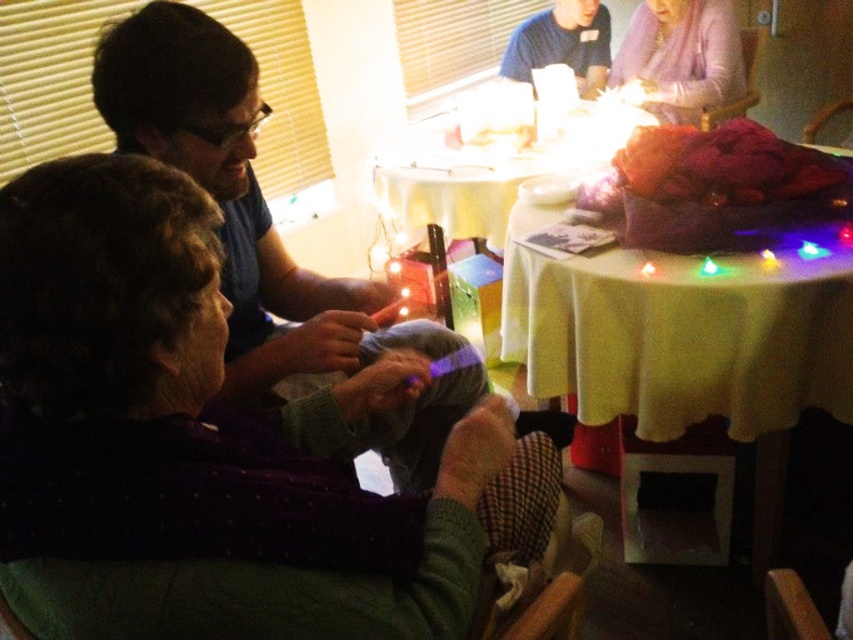
The height and width of the screenshot is (640, 853). What do you see at coordinates (241, 204) in the screenshot?
I see `matte blue shirt at left` at bounding box center [241, 204].

Does matte blue shirt at left have a lesser height compared to light pink sweater at upper right?

Incorrect, matte blue shirt at left's height does not fall short of light pink sweater at upper right's.

Is point (338, 289) positioned in front of point (642, 74)?

Yes.

Where is `matte blue shirt at left`? The width and height of the screenshot is (853, 640). matte blue shirt at left is located at coordinates (241, 204).

Is matte blue shirt at left shorter than yellow fabric table at center?

No, matte blue shirt at left is not shorter than yellow fabric table at center.

Measure the distance between matte blue shirt at left and yellow fabric table at center.

They are 3.73 feet apart.

Is point (312, 384) positioned after point (425, 182)?

No, it is not.

You are a GUI agent. You are given a task and a screenshot of the screen. Output one action in this format:
    pyautogui.click(x=<x>, y=<y>)
    Task: Click on the matte blue shirt at left
    This screenshot has width=853, height=640.
    Given the screenshot: What is the action you would take?
    pyautogui.click(x=241, y=204)

Who is more forward, (569, 156) or (581, 92)?

Point (569, 156)

Does yellow fabric table at center appear over blue t-shirt at upper center?

Incorrect, yellow fabric table at center is not positioned above blue t-shirt at upper center.

Which is in front, point (619, 134) or point (592, 80)?

Point (619, 134)

At what (x,y) coordinates should I click in order to perform the action: click on yellow fabric table at center. Please return your answer as a coordinate pair (x, y). The width and height of the screenshot is (853, 640). Looking at the image, I should click on (488, 172).